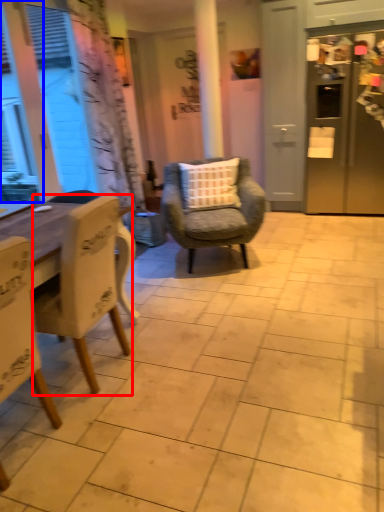
Question: Among these objects, which one is nearest to the camera, chair (highlighted by a red box) or window (highlighted by a blue box)?

Choices:
 (A) chair
 (B) window

Answer: (A)